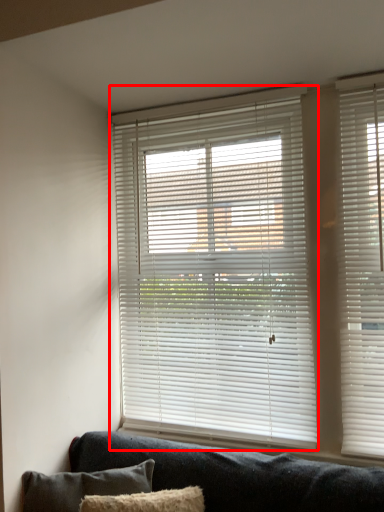
Question: In this image, where is window blind (annotated by the red box) located relative to pillow?

Choices:
 (A) right
 (B) left

Answer: (A)